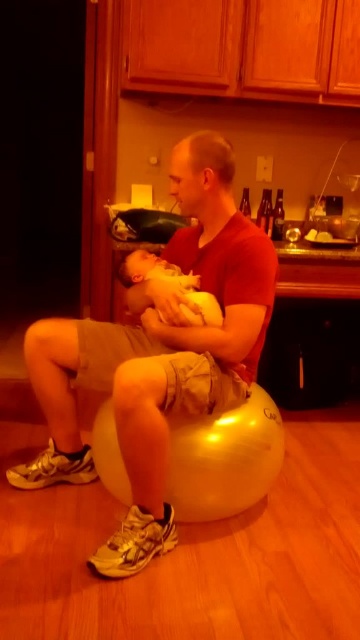
Is matte red shirt at center positioned in front of gold fabric bean bag chair at center?

Yes, it is.

Can you confirm if matte red shirt at center is positioned to the right of gold fabric bean bag chair at center?

Incorrect, matte red shirt at center is not on the right side of gold fabric bean bag chair at center.

Identify the location of matte red shirt at center. The width and height of the screenshot is (360, 640). (159, 355).

I want to click on matte red shirt at center, so click(159, 355).

Which is more to the right, matte red shirt at center or soft yellow fabric baby at center?

From the viewer's perspective, soft yellow fabric baby at center appears more on the right side.

Can you confirm if matte red shirt at center is wider than soft yellow fabric baby at center?

Indeed, matte red shirt at center has a greater width compared to soft yellow fabric baby at center.

This screenshot has width=360, height=640. Describe the element at coordinates (159, 355) in the screenshot. I see `matte red shirt at center` at that location.

Find the location of a particular element. matte red shirt at center is located at coordinates (159, 355).

Is point (209, 481) less distant than point (150, 260)?

That is True.

Between gold fabric bean bag chair at center and soft yellow fabric baby at center, which one appears on the left side from the viewer's perspective?

From the viewer's perspective, soft yellow fabric baby at center appears more on the left side.

What do you see at coordinates (225, 460) in the screenshot? This screenshot has width=360, height=640. I see `gold fabric bean bag chair at center` at bounding box center [225, 460].

I want to click on gold fabric bean bag chair at center, so click(x=225, y=460).